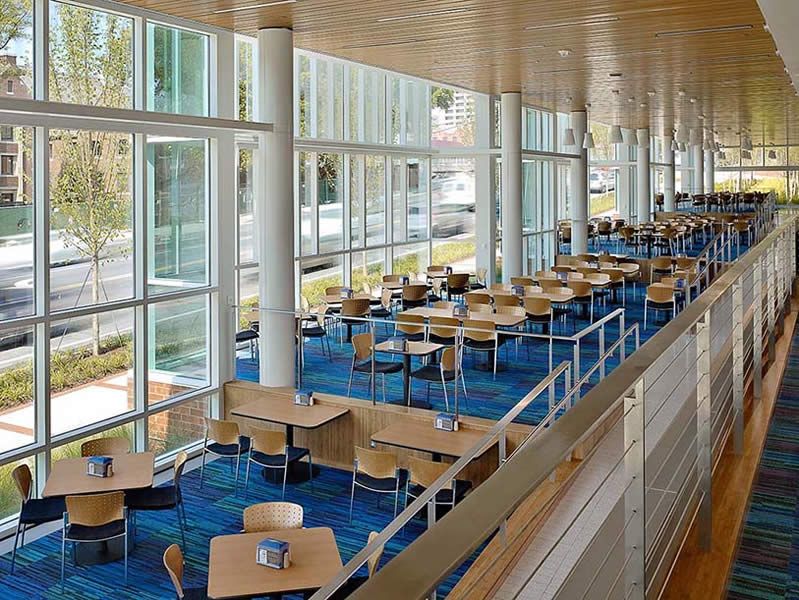
Find the location of `column`. column is located at coordinates (273, 196), (510, 183), (577, 196), (642, 190), (668, 182), (697, 177), (710, 170).